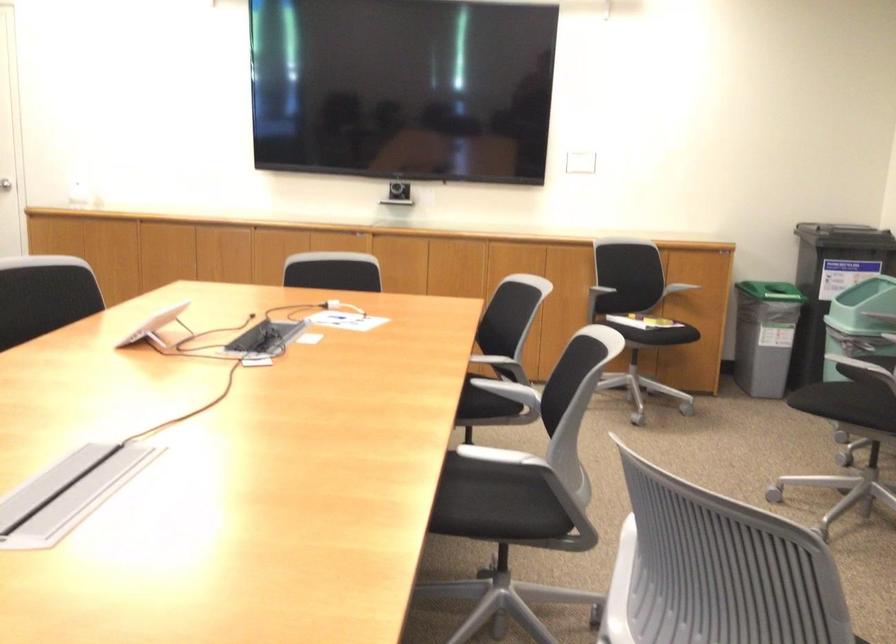
Which object does [156,327] point to?

It refers to a white conference tablet.